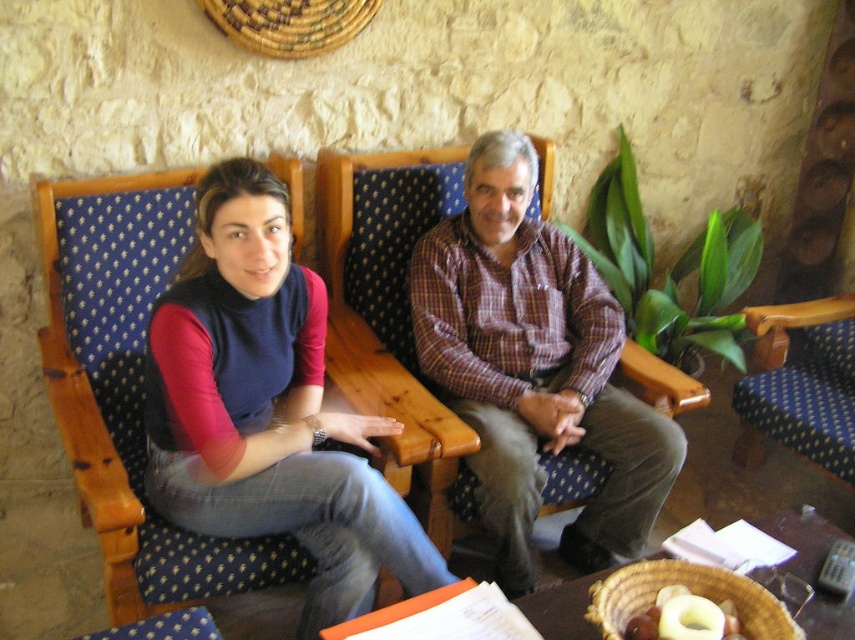
Question: Which object is positioned farthest from the matte blue jeans at center?

Choices:
 (A) yellow fabric armchair at right
 (B) matte blue fabric chair at upper left

Answer: (A)

Question: In this image, where is matte blue fabric chair at upper left located relative to matte blue jeans at center?

Choices:
 (A) right
 (B) left

Answer: (A)

Question: Can you confirm if matte blue fabric chair at upper left is bigger than plaid shirt at center?

Choices:
 (A) no
 (B) yes

Answer: (B)

Question: Does matte blue jeans at center appear on the right side of plaid shirt at center?

Choices:
 (A) no
 (B) yes

Answer: (A)

Question: Which point is farther to the camera?

Choices:
 (A) pos(49,237)
 (B) pos(824,337)
 (C) pos(216,458)

Answer: (B)

Question: Among these objects, which one is farthest from the camera?

Choices:
 (A) matte blue jeans at center
 (B) matte blue fabric chair at upper left
 (C) yellow fabric armchair at right

Answer: (C)